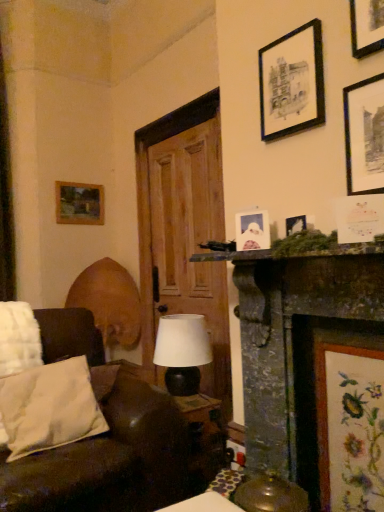
Question: Is matte white paper at upper right, which appears as the third picture frame when ordered from the bottom, bigger or smaller than white paper picture frame at upper center, the fourth picture frame positioned from the front?

Choices:
 (A) big
 (B) small

Answer: (A)

Question: Considering their positions, is matte white paper at upper right, the 1th picture frame from the front, located in front of or behind white paper picture frame at upper center, arranged as the second picture frame when viewed from the left?

Choices:
 (A) behind
 (B) front

Answer: (B)

Question: Estimate the real-world distances between objects in this image. Which object is farther from the black matte picture frame at upper right, which ranks as the sixth picture frame in bottom-to-top order?

Choices:
 (A) matte black lamp at center
 (B) white paper picture frame at upper center, which is counted as the fifth picture frame, starting from the right
 (C) matte white paper at upper right, the 4th picture frame from the top
 (D) white soft pillow at lower left
 (E) embroidered fabric at lower right, the 6th picture frame when ordered from top to bottom

Answer: (D)

Question: Estimate the real-world distances between objects in this image. Which object is closer to the wooden picture frame at upper left, which is the second picture frame in top-to-bottom order?

Choices:
 (A) matte white paper at upper right, the 4th picture frame from the top
 (B) embroidered fabric at lower right, the 6th picture frame when ordered from top to bottom
 (C) white paper picture frame at upper center, acting as the 2th picture frame starting from the bottom
 (D) brown leather couch at lower left
 (E) black matte picture frame at upper right, the 3th picture frame in the top-to-bottom sequence

Answer: (D)